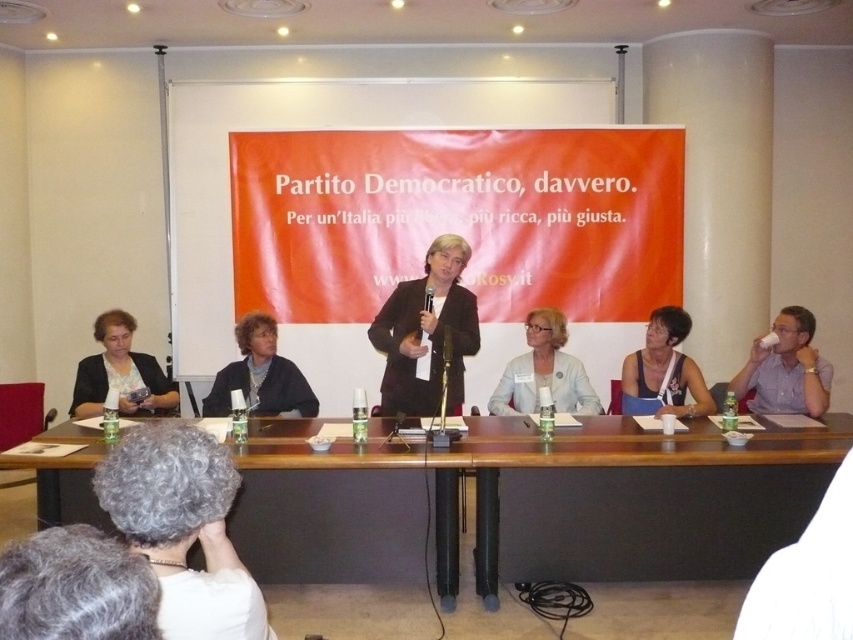
Which is behind, point (527, 550) or point (173, 612)?

The point (527, 550) is behind.

Based on the photo, which of these two, brown wood table at center or gray curly hair at lower left, stands taller?

With more height is brown wood table at center.

In order to click on brown wood table at center in this screenshot , I will do `click(643, 500)`.

Image resolution: width=853 pixels, height=640 pixels. I want to click on brown wood table at center, so click(x=643, y=500).

Is brown wood table at center bigger than white matte cup at right?

Correct, brown wood table at center is larger in size than white matte cup at right.

Is point (741, 573) more distant than point (782, 310)?

No, (741, 573) is in front of (782, 310).

This screenshot has width=853, height=640. Find the location of `brown wood table at center`. brown wood table at center is located at coordinates (643, 500).

Does light blue fabric jacket at center appear on the right side of matte black jacket at center?

Indeed, light blue fabric jacket at center is positioned on the right side of matte black jacket at center.

Which of these two, light blue fabric jacket at center or matte black jacket at center, stands shorter?

With less height is matte black jacket at center.

Measure the distance between light blue fabric jacket at center and camera.

light blue fabric jacket at center and camera are 4.23 meters apart from each other.

You are a GUI agent. You are given a task and a screenshot of the screen. Output one action in this format:
    pyautogui.click(x=<x>, y=<y>)
    Task: Click on the light blue fabric jacket at center
    The height and width of the screenshot is (640, 853).
    Given the screenshot: What is the action you would take?
    pyautogui.click(x=544, y=371)